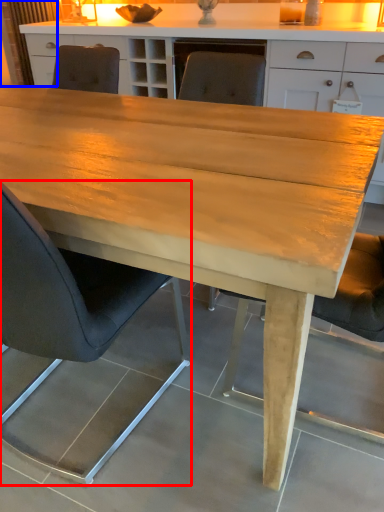
Question: Which point is closer to the camera, chair (highlighted by a red box) or curtain (highlighted by a blue box)?

Choices:
 (A) chair
 (B) curtain

Answer: (A)